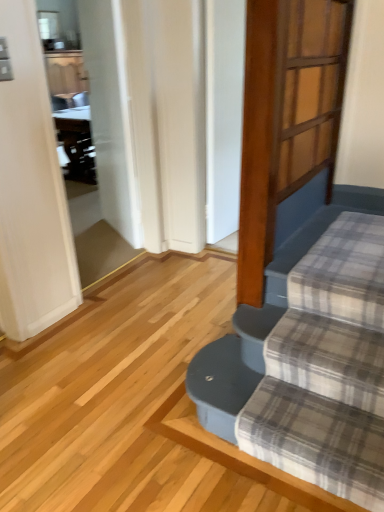
Question: From the image's perspective, is white glossy screen door at upper left, which is the first screen door from back to front, beneath wooden screen door at upper right, the 1th screen door when ordered from right to left?

Choices:
 (A) no
 (B) yes

Answer: (A)

Question: Does white glossy screen door at upper left, the 2th screen door in the front-to-back sequence, lie in front of wooden screen door at upper right, which is counted as the 2th screen door, starting from the back?

Choices:
 (A) no
 (B) yes

Answer: (A)

Question: From the image's perspective, does white glossy screen door at upper left, placed as the 1th screen door when sorted from left to right, appear higher than wooden screen door at upper right, acting as the 2th screen door starting from the left?

Choices:
 (A) yes
 (B) no

Answer: (A)

Question: Could wooden screen door at upper right, the 1th screen door when ordered from right to left, be considered to be inside white glossy screen door at upper left, placed as the 1th screen door when sorted from left to right?

Choices:
 (A) no
 (B) yes

Answer: (A)

Question: Is white glossy screen door at upper left, which is the first screen door from back to front, at the right side of wooden screen door at upper right, acting as the 2th screen door starting from the left?

Choices:
 (A) yes
 (B) no

Answer: (B)

Question: In terms of size, does white glossy screen door at upper left, placed as the 1th screen door when sorted from left to right, appear bigger or smaller than wooden screen door at upper right, which is counted as the 2th screen door, starting from the back?

Choices:
 (A) big
 (B) small

Answer: (A)

Question: From a real-world perspective, relative to wooden screen door at upper right, which is counted as the 2th screen door, starting from the back, is white glossy screen door at upper left, the 2th screen door in the right-to-left sequence, vertically above or below?

Choices:
 (A) above
 (B) below

Answer: (B)

Question: Is white glossy screen door at upper left, the 2th screen door in the right-to-left sequence, to the left or to the right of wooden screen door at upper right, acting as the 2th screen door starting from the left, in the image?

Choices:
 (A) right
 (B) left

Answer: (B)

Question: From the image's perspective, is white glossy screen door at upper left, placed as the 1th screen door when sorted from left to right, positioned above or below wooden screen door at upper right, acting as the 2th screen door starting from the left?

Choices:
 (A) below
 (B) above

Answer: (B)

Question: Considering the positions of wooden screen door at upper right, acting as the 2th screen door starting from the left, and plaid fabric at lower right in the image, is wooden screen door at upper right, acting as the 2th screen door starting from the left, bigger or smaller than plaid fabric at lower right?

Choices:
 (A) big
 (B) small

Answer: (B)

Question: Is wooden screen door at upper right, the 1th screen door when ordered from right to left, situated inside plaid fabric at lower right or outside?

Choices:
 (A) inside
 (B) outside

Answer: (B)

Question: Does point (314, 67) appear closer or farther from the camera than point (284, 256)?

Choices:
 (A) farther
 (B) closer

Answer: (B)

Question: In the image, is wooden screen door at upper right, acting as the 2th screen door starting from the left, positioned in front of or behind plaid fabric at lower right?

Choices:
 (A) front
 (B) behind

Answer: (B)

Question: Is point (332, 89) positioned closer to the camera than point (125, 200)?

Choices:
 (A) farther
 (B) closer

Answer: (B)

Question: In terms of width, does wooden screen door at upper right, which is counted as the 2th screen door, starting from the back, look wider or thinner when compared to white glossy screen door at upper left, which is the first screen door from back to front?

Choices:
 (A) wide
 (B) thin

Answer: (B)